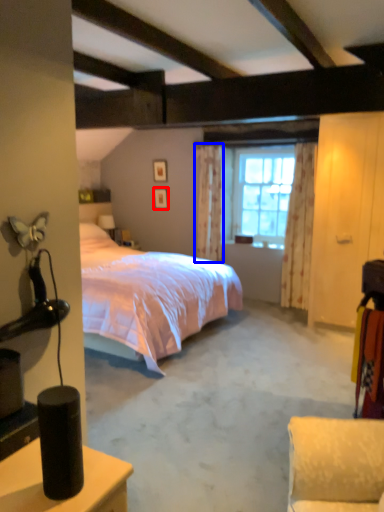
Question: Which object appears closest to the camera in this image, picture frame (highlighted by a red box) or curtain (highlighted by a blue box)?

Choices:
 (A) picture frame
 (B) curtain

Answer: (B)